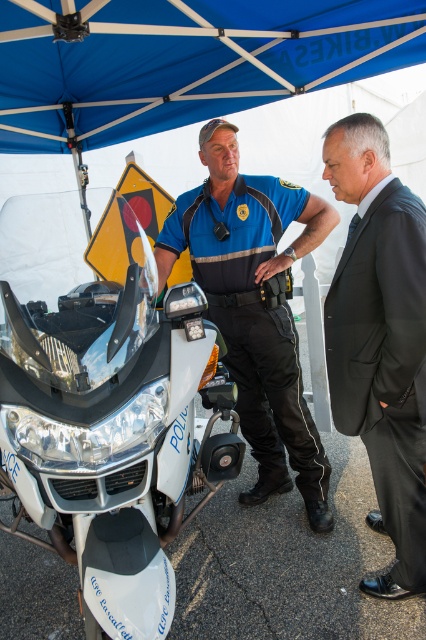
Is white glossy motorcycle at center above blue fabric canopy at upper center?

No, white glossy motorcycle at center is not above blue fabric canopy at upper center.

Does white glossy motorcycle at center appear on the right side of blue fabric canopy at upper center?

No, white glossy motorcycle at center is not to the right of blue fabric canopy at upper center.

Measure the distance between point (x=37, y=508) and camera.

Point (x=37, y=508) and camera are 6.31 feet apart.

Identify the location of white glossy motorcycle at center. This screenshot has height=640, width=426. click(103, 408).

Does white glossy motorcycle at center appear over blue uniform at center?

No, white glossy motorcycle at center is not above blue uniform at center.

Is point (198, 481) positioned behind point (229, 138)?

No, it is not.

Which is in front, point (158, 449) or point (330, 220)?

Point (158, 449) is in front.

I want to click on white glossy motorcycle at center, so click(x=103, y=408).

Is blue fabric canopy at upper center positioned before blue uniform at center?

That is True.

You are a GUI agent. You are given a task and a screenshot of the screen. Output one action in this format:
    pyautogui.click(x=<x>, y=<y>)
    Task: Click on the blue fabric canopy at upper center
    The height and width of the screenshot is (640, 426).
    Given the screenshot: What is the action you would take?
    pyautogui.click(x=181, y=60)